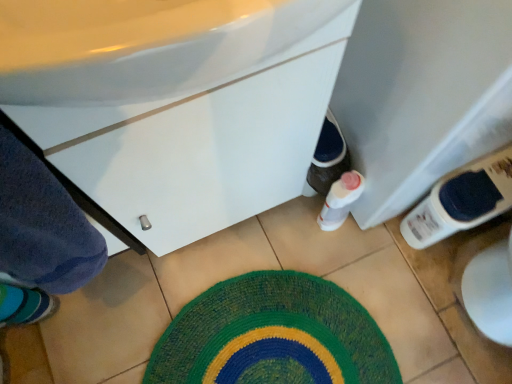
The height and width of the screenshot is (384, 512). Identify the location of white plastic bottle at lower right. (462, 200).

Locate an element on the screen. This screenshot has width=512, height=384. knitted green bath mat at center is located at coordinates (273, 336).

Find the location of `white plastic bottle at lower right`. white plastic bottle at lower right is located at coordinates (462, 200).

Considering the sizes of objects white plastic bottle at lower right and white glossy cabinet at center in the image provided, who is taller, white plastic bottle at lower right or white glossy cabinet at center?

Standing taller between the two is white plastic bottle at lower right.

The height and width of the screenshot is (384, 512). Find the location of `bathroom cabinet on the left of the white plastic bottle at lower right`. bathroom cabinet on the left of the white plastic bottle at lower right is located at coordinates (202, 134).

Is point (403, 231) closer or farther from the camera than point (173, 239)?

Clearly, point (403, 231) is more distant from the camera than point (173, 239).

Considering the relative sizes of white glossy cabinet at center and knitted green bath mat at center in the image provided, is white glossy cabinet at center taller than knitted green bath mat at center?

Yes.

Considering the relative positions of white glossy cabinet at center and knitted green bath mat at center in the image provided, is white glossy cabinet at center in front of knitted green bath mat at center?

Yes, white glossy cabinet at center is in front of knitted green bath mat at center.

From the image's perspective, is knitted green bath mat at center on top of white plastic bottle at lower right?

No, from the image's perspective, knitted green bath mat at center is not over white plastic bottle at lower right.

Is knitted green bath mat at center positioned beyond the bounds of white plastic bottle at lower right?

Indeed, knitted green bath mat at center is completely outside white plastic bottle at lower right.

How many degrees apart are the facing directions of knitted green bath mat at center and white plastic bottle at lower right?

The facing directions of knitted green bath mat at center and white plastic bottle at lower right are 0.000257 degrees apart.

Between knitted green bath mat at center and white plastic bottle at lower right, which one has less height?

knitted green bath mat at center is shorter.

How many degrees apart are the facing directions of white glossy cabinet at center and white plastic bottle at lower right?

There is a 89.9-degree angle between the facing directions of white glossy cabinet at center and white plastic bottle at lower right.

Which is less distant, [298,131] or [449,181]?

The point [298,131] is closer to the camera.

Are white glossy cabinet at center and white plastic bottle at lower right making contact?

white glossy cabinet at center and white plastic bottle at lower right are clearly separated.

Which is more distant, (506, 158) or (322, 298)?

The point (322, 298) is more distant.

Is white plastic bottle at lower right far away from knitted green bath mat at center?

No, white plastic bottle at lower right is not far from knitted green bath mat at center.

Is white plastic bottle at lower right smaller than knitted green bath mat at center?

Actually, white plastic bottle at lower right might be larger than knitted green bath mat at center.

Is white plastic bottle at lower right situated inside knitted green bath mat at center or outside?

The correct answer is: outside.

Does knitted green bath mat at center have a lesser width compared to white glossy cabinet at center?

No, knitted green bath mat at center is not thinner than white glossy cabinet at center.

Is knitted green bath mat at center looking in the opposite direction of white glossy cabinet at center?

No, knitted green bath mat at center's orientation is not away from white glossy cabinet at center.

From their relative heights in the image, would you say knitted green bath mat at center is taller or shorter than white glossy cabinet at center?

knitted green bath mat at center is shorter than white glossy cabinet at center.

Consider the image. Is knitted green bath mat at center to the left or to the right of white glossy cabinet at center in the image?

knitted green bath mat at center is to the right of white glossy cabinet at center.

This screenshot has width=512, height=384. In the image, there is a white plastic bottle at lower right. Identify the location of bathroom cabinet above it (from the image's perspective). (202, 134).

Locate an element on the screen. The width and height of the screenshot is (512, 384). bath mat located underneath the white glossy cabinet at center (from a real-world perspective) is located at coordinates coord(273,336).

Which object lies further to the anchor point white glossy cabinet at center, white plastic bottle at lower right or knitted green bath mat at center?

white plastic bottle at lower right is further to white glossy cabinet at center.

Based on their spatial positions, is white glossy cabinet at center or knitted green bath mat at center further from white plastic bottle at lower right?

white glossy cabinet at center is positioned further to the anchor white plastic bottle at lower right.

Considering their positions, is white plastic bottle at lower right positioned closer to knitted green bath mat at center than white glossy cabinet at center?

Based on the image, white plastic bottle at lower right appears to be nearer to knitted green bath mat at center.

Which object lies further to the anchor point white glossy cabinet at center, knitted green bath mat at center or white plastic bottle at lower right?

white plastic bottle at lower right is positioned further to the anchor white glossy cabinet at center.

Looking at the image, which one is located further to knitted green bath mat at center, white glossy cabinet at center or white plastic bottle at lower right?

Among the two, white glossy cabinet at center is located further to knitted green bath mat at center.

Looking at this image, based on their spatial positions, is knitted green bath mat at center or white glossy cabinet at center further from white plastic bottle at lower right?

white glossy cabinet at center.

I want to click on bottle located between white glossy cabinet at center and knitted green bath mat at center in the depth direction, so click(462, 200).